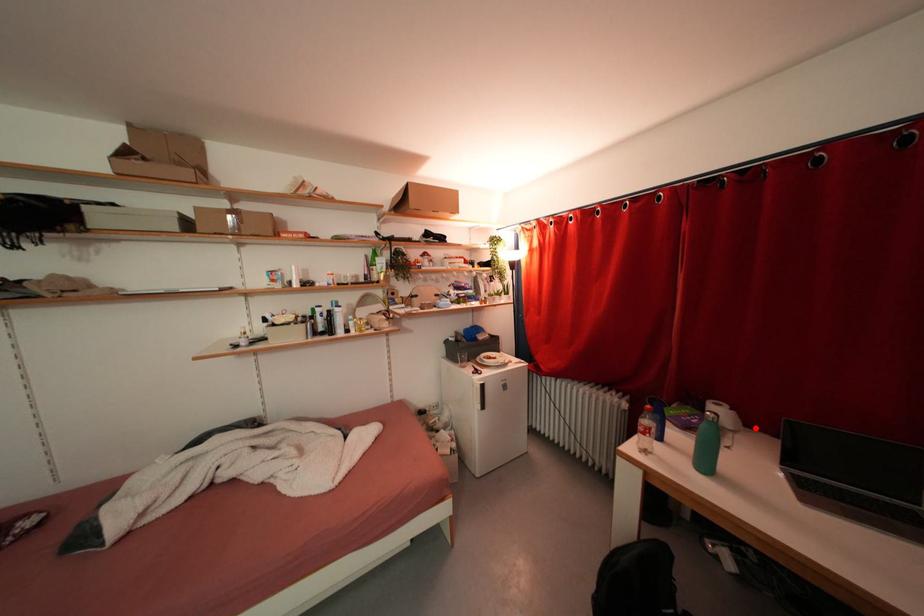
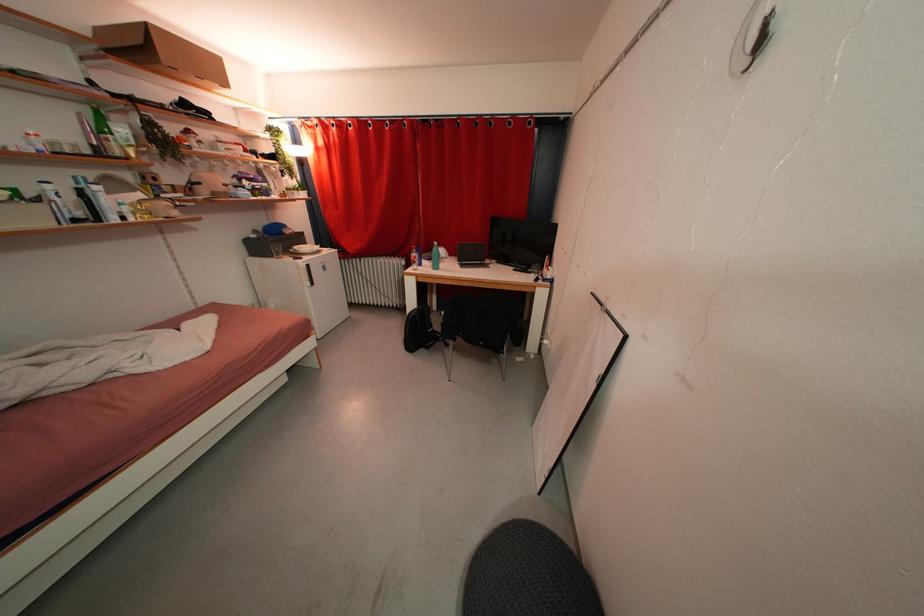
Find the pixel in the second image that matches the highlighted location in the first image.

(456, 257)